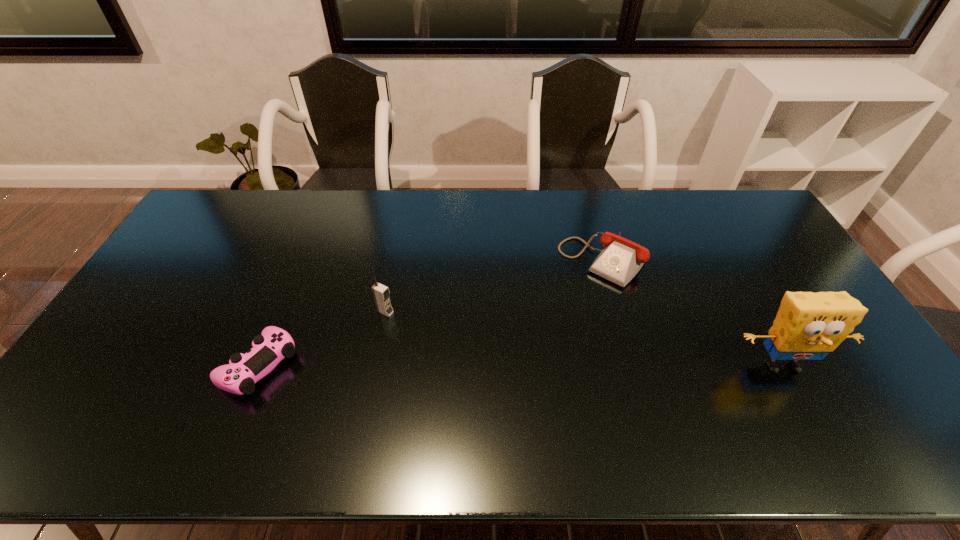
Find the location of a particular element. vacant region located 0.320m on the front-facing side of the second object from left to right is located at coordinates (487, 363).

The height and width of the screenshot is (540, 960). Find the location of `vacant space located 0.070m on the dial of the farthest object`. vacant space located 0.070m on the dial of the farthest object is located at coordinates (570, 296).

The width and height of the screenshot is (960, 540). I want to click on free space located on the dial of the farthest object, so click(548, 323).

This screenshot has width=960, height=540. In order to click on vacant space situated on the dial of the farthest object in this screenshot , I will do `click(557, 313)`.

Identify the location of control that is at the near edge. This screenshot has height=540, width=960. (238, 377).

Where is `sponge located at the near edge`? The height and width of the screenshot is (540, 960). sponge located at the near edge is located at coordinates pos(808,325).

Find the location of `object at the right edge`. object at the right edge is located at coordinates (808, 325).

Identify the location of object that is at the near right corner. (808, 325).

Identify the location of vacant space at the far edge. (587, 221).

Where is `vacant space at the left edge`? vacant space at the left edge is located at coordinates (208, 240).